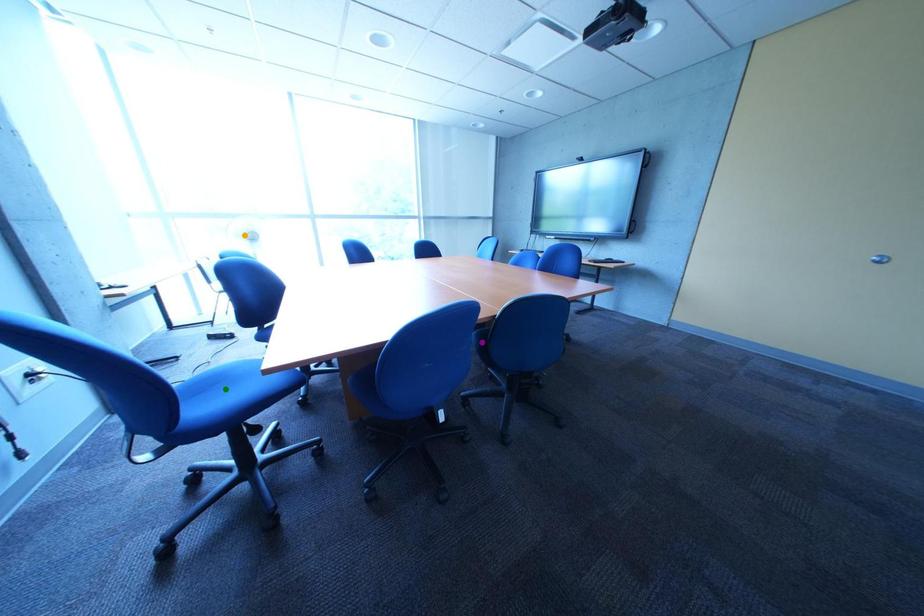
Order these from nearest to farthest:
- green point
- orange point
- purple point

green point → purple point → orange point